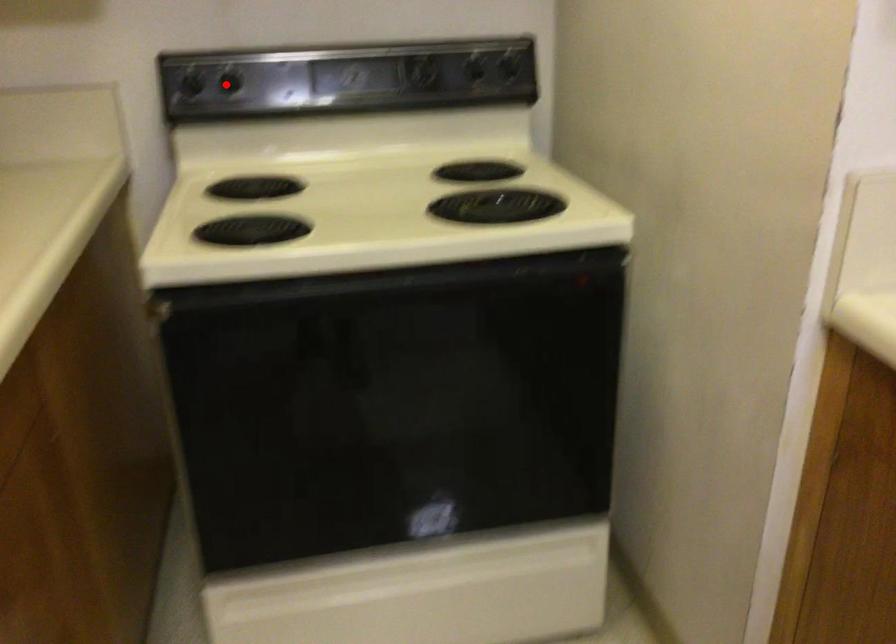
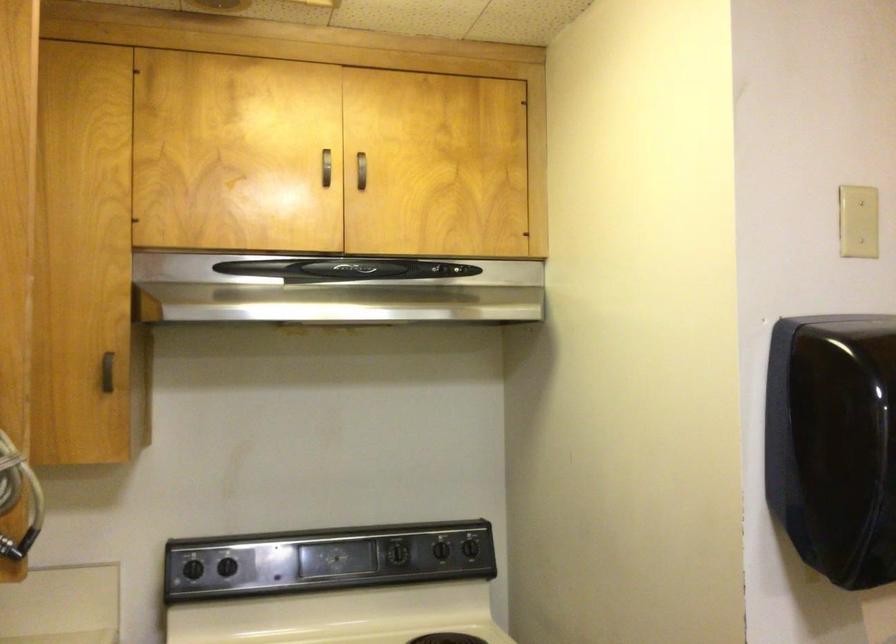
Question: I am providing you with two images of the same scene from different viewpoints. A red point is marked on the first image. Can you still see the location of the red point in image 2?

Choices:
 (A) Yes
 (B) No

Answer: (A)